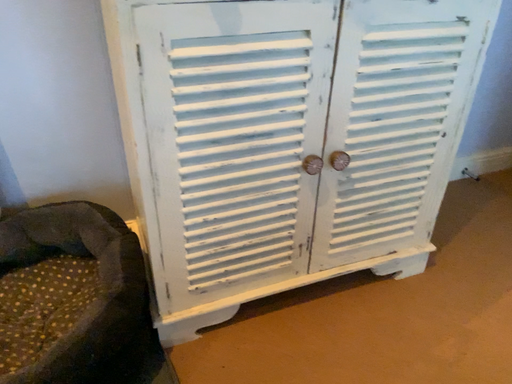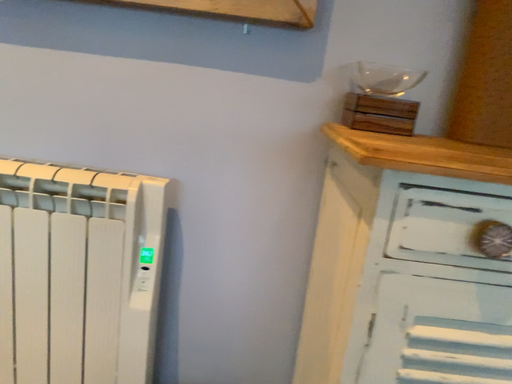
Question: Which way did the camera rotate in the video?

Choices:
 (A) rotated left
 (B) rotated right

Answer: (A)